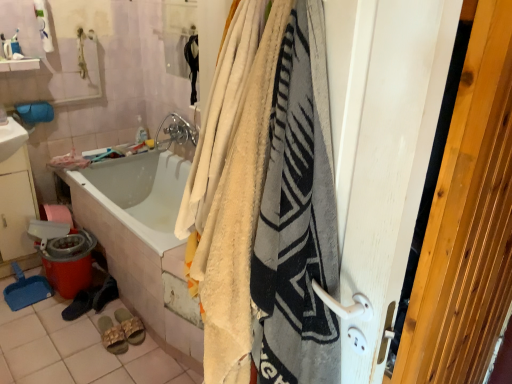
This screenshot has width=512, height=384. Find the location of `free space to the left of black fabric shoe at lower left, the 1th footwear from the left`. free space to the left of black fabric shoe at lower left, the 1th footwear from the left is located at coordinates (46, 307).